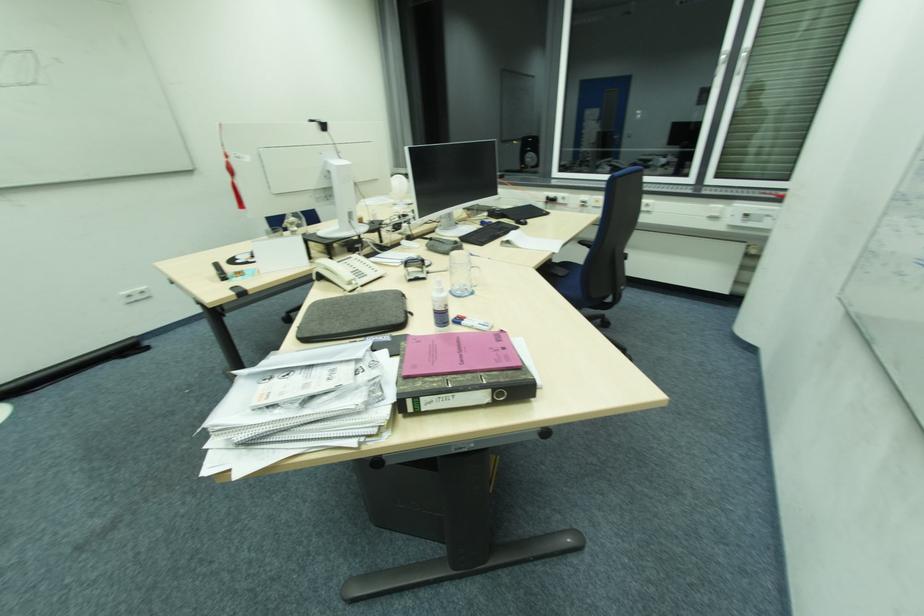
In order to click on computer mouse in this screenshot , I will do `click(500, 229)`.